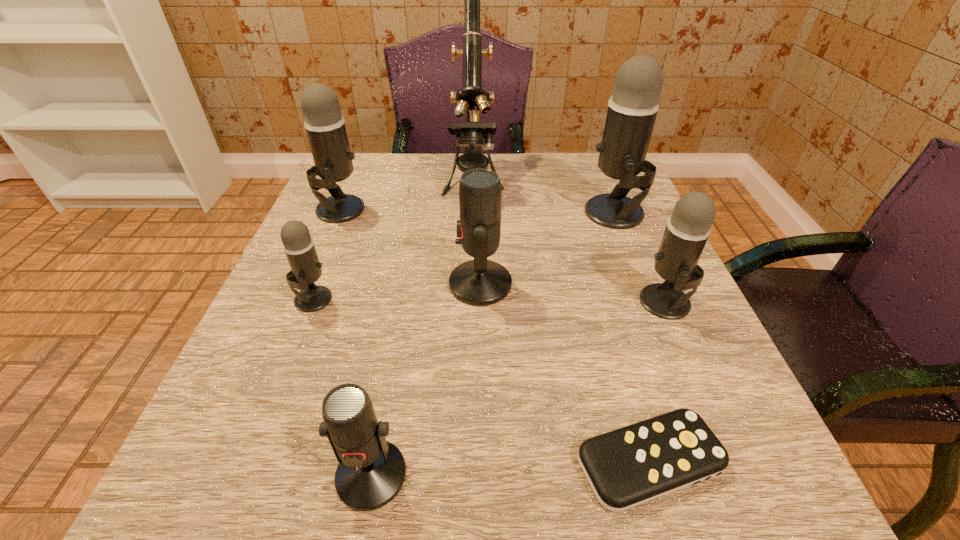
You are a GUI agent. You are given a task and a screenshot of the screen. Output one action in this format:
    pyautogui.click(x=<x>, y=<y>)
    Task: Click on the free space between the second biggest gray microphone and the remote control
    The image size is (960, 540).
    Given the screenshot: What is the action you would take?
    pyautogui.click(x=495, y=335)

I want to click on free point between the farther red microphone and the second smallest gray microphone, so click(x=573, y=293).

Find the location of a particular element. Image resolution: width=960 pixels, height=540 pixels. the second closest object to the smallest gray microphone is located at coordinates (480, 282).

Locate which object ranks in proximity to the tallest microphone. Please provide its 2D coordinates. Your answer should be formatted as a tuple, i.e. [(x, y)], where the tuple contains the x and y coordinates of a point satisfying the conditions above.

[(687, 231)]

Select which microphone appears as the third closest to the smallest gray microphone. Please provide its 2D coordinates. Your answer should be formatted as a tuple, i.e. [(x, y)], where the tuple contains the x and y coordinates of a point satisfying the conditions above.

[(371, 471)]

Locate which microphone ranks third in proximity to the second smallest gray microphone. Please provide its 2D coordinates. Your answer should be formatted as a tuple, i.e. [(x, y)], where the tuple contains the x and y coordinates of a point satisfying the conditions above.

[(371, 471)]

Select which gray microphone appears as the second closest to the bigger red microphone. Please provide its 2D coordinates. Your answer should be formatted as a tuple, i.e. [(x, y)], where the tuple contains the x and y coordinates of a point satisfying the conditions above.

[(299, 247)]

Locate which gray microphone is the closest to the right red microphone. Please provide its 2D coordinates. Your answer should be formatted as a tuple, i.e. [(x, y)], where the tuple contains the x and y coordinates of a point satisfying the conditions above.

[(632, 109)]

Identify the location of vacant space that satisfies the following two spatial constraints: 1. on the front side of the second tallest object; 2. on the left side of the sixth shortest object. (339, 213).

Locate an element on the screen. vacant space that satisfies the following two spatial constraints: 1. through the eyepiece of the tallest object; 2. on the right side of the shortest object is located at coordinates (467, 461).